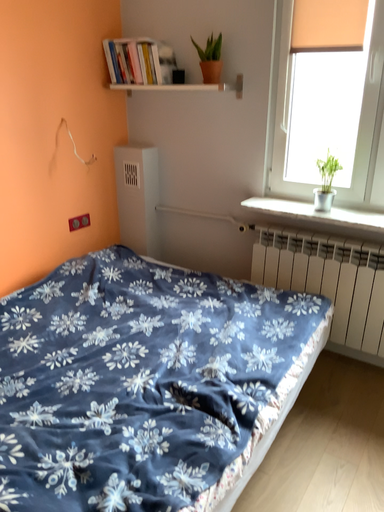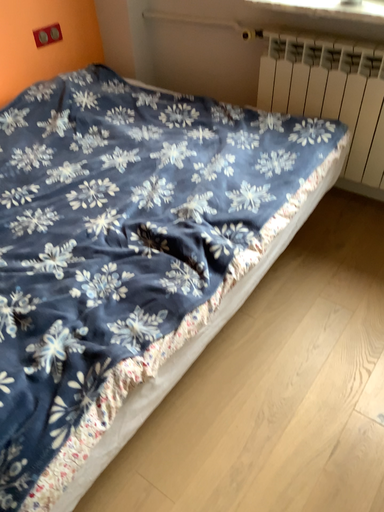
Question: Which way did the camera rotate in the video?

Choices:
 (A) rotated upward
 (B) rotated downward

Answer: (B)